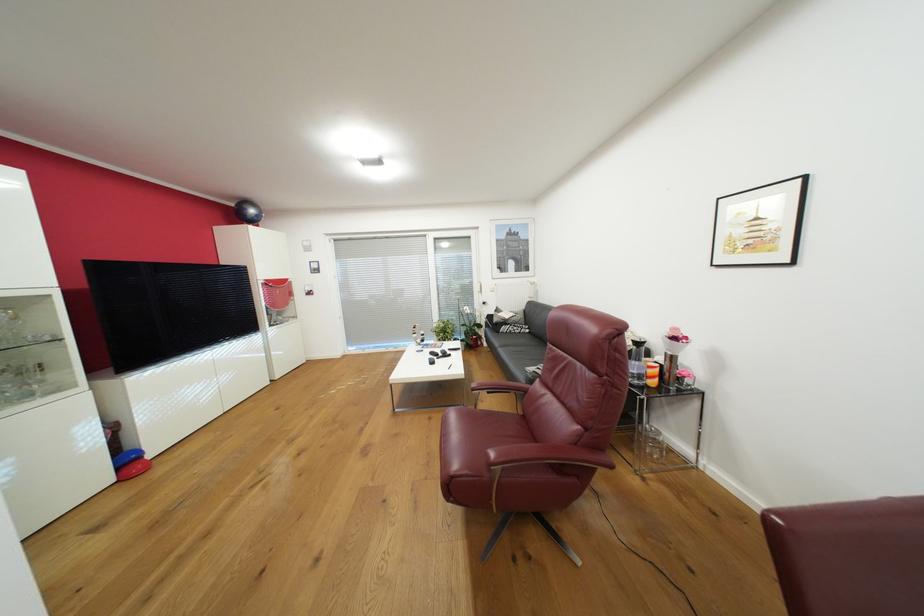
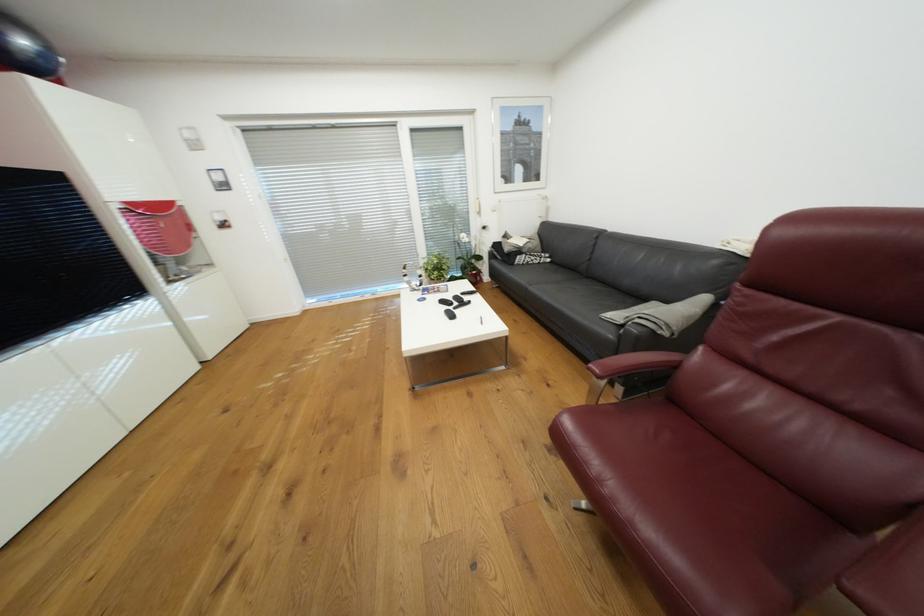
The point at [439,353] is marked in the first image. Where is the corresponding point in the second image?

(448, 302)